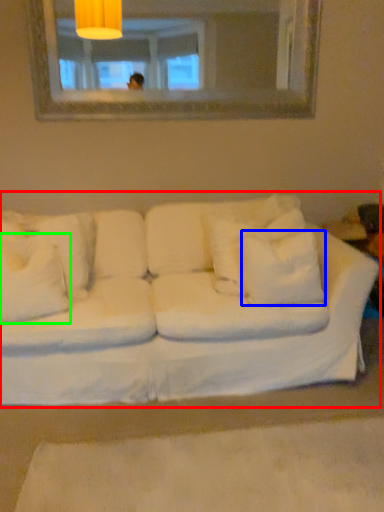
Question: Which object is positioned closest to studio couch (highlighted by a red box)? Select from pillow (highlighted by a blue box) and pillow (highlighted by a green box).

Choices:
 (A) pillow
 (B) pillow

Answer: (A)